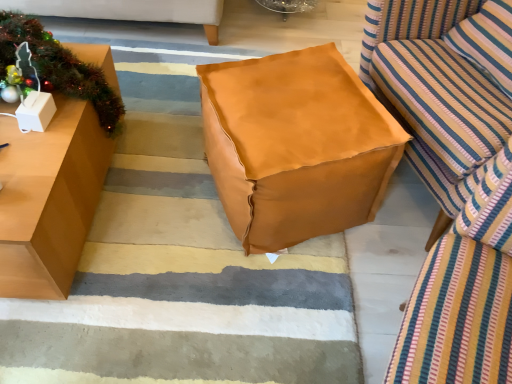
Identify the location of empty space that is ontop of leather-like tan bean bag at center (from a real-world perspective). (306, 91).